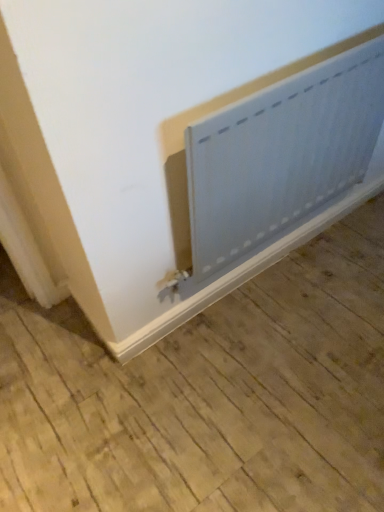
This screenshot has height=512, width=384. Identify the location of matte gray radiator at lower right. (208, 394).

This screenshot has height=512, width=384. What do you see at coordinates (208, 394) in the screenshot?
I see `matte gray radiator at lower right` at bounding box center [208, 394].

Measure the distance between point [268,457] and camera.

Point [268,457] and camera are 3.76 feet apart from each other.

Identify the location of white matte radiator at lower center. (281, 155).

Measure the distance between white matte radiator at lower center and camera.

The distance of white matte radiator at lower center from camera is 33.83 inches.

What do you see at coordinates (281, 155) in the screenshot?
I see `white matte radiator at lower center` at bounding box center [281, 155].

Image resolution: width=384 pixels, height=512 pixels. Identify the location of matte gray radiator at lower right. (208, 394).

In the image, is white matte radiator at lower center on the left side or the right side of matte gray radiator at lower right?

Based on their positions, white matte radiator at lower center is located to the right of matte gray radiator at lower right.

Relative to matte gray radiator at lower right, is white matte radiator at lower center in front or behind?

Visually, white matte radiator at lower center is located behind matte gray radiator at lower right.

Which is behind, point (326, 177) or point (38, 486)?

The point (326, 177) is farther from the camera.

From the image's perspective, does white matte radiator at lower center appear lower than matte gray radiator at lower right?

No, from the image's perspective, white matte radiator at lower center is not beneath matte gray radiator at lower right.

From a real-world perspective, is white matte radiator at lower center physically below matte gray radiator at lower right?

No, from a real-world perspective, white matte radiator at lower center is not under matte gray radiator at lower right.

Which object is thinner, white matte radiator at lower center or matte gray radiator at lower right?

white matte radiator at lower center.

In terms of height, does white matte radiator at lower center look taller or shorter compared to matte gray radiator at lower right?

In the image, white matte radiator at lower center appears to be taller than matte gray radiator at lower right.

Which of these two, white matte radiator at lower center or matte gray radiator at lower right, is smaller?

Answer: With smaller size is white matte radiator at lower center.

Is white matte radiator at lower center not within matte gray radiator at lower right?

Absolutely, white matte radiator at lower center is external to matte gray radiator at lower right.

Is white matte radiator at lower center not near matte gray radiator at lower right?

No, there isn't a large distance between white matte radiator at lower center and matte gray radiator at lower right.

Is white matte radiator at lower center turned away from matte gray radiator at lower right?

white matte radiator at lower center is not turned away from matte gray radiator at lower right.

The width and height of the screenshot is (384, 512). There is a matte gray radiator at lower right. Find the location of `radiator above it (from a real-world perspective)`. radiator above it (from a real-world perspective) is located at coordinates (x=281, y=155).

Considering the relative positions of matte gray radiator at lower right and white matte radiator at lower center in the image provided, is matte gray radiator at lower right to the left or to the right of white matte radiator at lower center?

matte gray radiator at lower right is to the left of white matte radiator at lower center.

Is matte gray radiator at lower right further to camera compared to white matte radiator at lower center?

No, it is in front of white matte radiator at lower center.

Which is behind, point (179, 442) or point (324, 84)?

Point (179, 442)

Looking at this image, from the image's perspective, would you say matte gray radiator at lower right is shown under white matte radiator at lower center?

Indeed, from the image's perspective, matte gray radiator at lower right is shown beneath white matte radiator at lower center.

From a real-world perspective, is matte gray radiator at lower right under white matte radiator at lower center?

Indeed, from a real-world perspective, matte gray radiator at lower right is positioned beneath white matte radiator at lower center.

Which object is wider, matte gray radiator at lower right or white matte radiator at lower center?

matte gray radiator at lower right.

Considering the sizes of matte gray radiator at lower right and white matte radiator at lower center in the image, is matte gray radiator at lower right taller or shorter than white matte radiator at lower center?

Considering their sizes, matte gray radiator at lower right has less height than white matte radiator at lower center.

Is matte gray radiator at lower right bigger or smaller than white matte radiator at lower center?

matte gray radiator at lower right is bigger than white matte radiator at lower center.

Would you say matte gray radiator at lower right is inside or outside white matte radiator at lower center?

matte gray radiator at lower right is located beyond the bounds of white matte radiator at lower center.

Is matte gray radiator at lower right in contact with white matte radiator at lower center?

No, matte gray radiator at lower right is not touching white matte radiator at lower center.

Could you tell me if matte gray radiator at lower right is facing white matte radiator at lower center?

No.

Locate an element on the screen. This screenshot has width=384, height=512. plywood lying below the white matte radiator at lower center (from the image's perspective) is located at coordinates (208, 394).

Image resolution: width=384 pixels, height=512 pixels. I want to click on radiator above the matte gray radiator at lower right (from a real-world perspective), so click(281, 155).

The height and width of the screenshot is (512, 384). I want to click on radiator that appears behind the matte gray radiator at lower right, so coord(281,155).